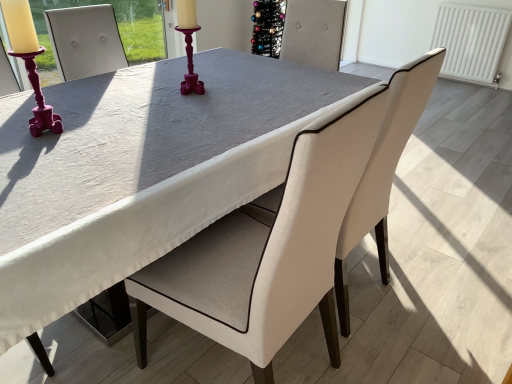
Question: From the image's perspective, is matte pink candlestick at left located beneath white fabric chair at center, the first chair viewed from the right?

Choices:
 (A) no
 (B) yes

Answer: (A)

Question: From the image's perspective, is matte pink candlestick at left on top of white fabric chair at center, the first chair viewed from the right?

Choices:
 (A) yes
 (B) no

Answer: (A)

Question: Considering the relative sizes of matte pink candlestick at left and white fabric chair at center, the first chair viewed from the right, in the image provided, is matte pink candlestick at left smaller than white fabric chair at center, the first chair viewed from the right,?

Choices:
 (A) no
 (B) yes

Answer: (B)

Question: Would you say matte pink candlestick at left is a long distance from white fabric chair at center, the first chair viewed from the right?

Choices:
 (A) yes
 (B) no

Answer: (A)

Question: From a real-world perspective, is matte pink candlestick at left on top of white fabric chair at center, the first chair viewed from the right?

Choices:
 (A) no
 (B) yes

Answer: (B)

Question: From a real-world perspective, is matte pink candlestick at left beneath white fabric chair at center, the 2th chair positioned from the left?

Choices:
 (A) yes
 (B) no

Answer: (B)

Question: Does matte pink candlestick at left come behind white fabric chair at center, which is the 2th chair from right to left?

Choices:
 (A) no
 (B) yes

Answer: (B)

Question: Can you confirm if matte pink candlestick at left is smaller than white fabric chair at center, positioned as the first chair in left-to-right order?

Choices:
 (A) yes
 (B) no

Answer: (A)

Question: Is matte pink candlestick at left shorter than white fabric chair at center, positioned as the first chair in left-to-right order?

Choices:
 (A) no
 (B) yes

Answer: (B)

Question: Does matte pink candlestick at left have a greater width compared to white fabric chair at center, which is the 2th chair from right to left?

Choices:
 (A) yes
 (B) no

Answer: (B)

Question: Does matte pink candlestick at left have a lesser width compared to white fabric chair at center, which is the 2th chair from right to left?

Choices:
 (A) yes
 (B) no

Answer: (A)

Question: Is matte pink candlestick at left surrounding white fabric chair at center, which is the 2th chair from right to left?

Choices:
 (A) no
 (B) yes

Answer: (A)

Question: Is white fabric chair at center, the 2th chair positioned from the left, shorter than white fabric chair at center, positioned as the first chair in left-to-right order?

Choices:
 (A) no
 (B) yes

Answer: (B)